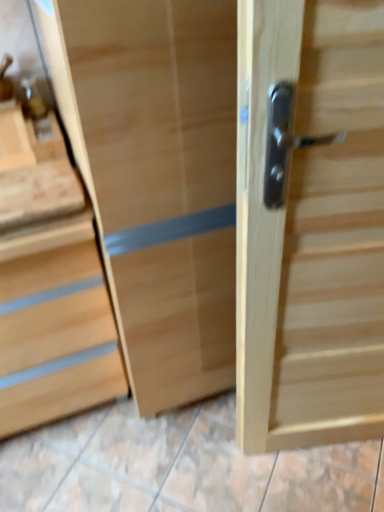
Question: Is natural wood door handle at right taller or shorter than natural wood chest of drawers at left?

Choices:
 (A) short
 (B) tall

Answer: (B)

Question: Considering the relative positions of natural wood door handle at right and natural wood chest of drawers at left in the image provided, is natural wood door handle at right to the left or to the right of natural wood chest of drawers at left?

Choices:
 (A) left
 (B) right

Answer: (B)

Question: In the image, is natural wood door handle at right positioned in front of or behind natural wood chest of drawers at left?

Choices:
 (A) front
 (B) behind

Answer: (A)

Question: From a real-world perspective, is natural wood chest of drawers at left above or below natural wood door handle at right?

Choices:
 (A) above
 (B) below

Answer: (B)

Question: Is natural wood chest of drawers at left in front of or behind natural wood door handle at right in the image?

Choices:
 (A) front
 (B) behind

Answer: (B)

Question: Looking at the image, does natural wood chest of drawers at left seem bigger or smaller compared to natural wood door handle at right?

Choices:
 (A) small
 (B) big

Answer: (B)

Question: Is natural wood chest of drawers at left spatially inside natural wood door handle at right, or outside of it?

Choices:
 (A) inside
 (B) outside

Answer: (B)